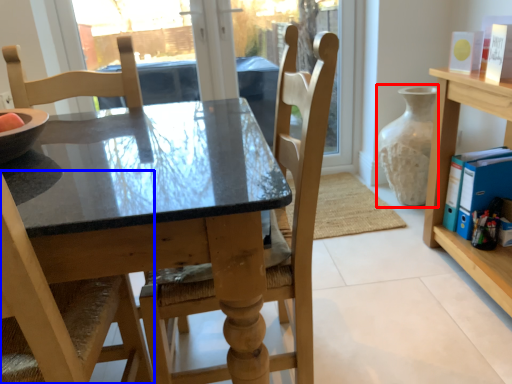
Question: Which object appears farthest to the camera in this image, glass vase (highlighted by a red box) or chair (highlighted by a blue box)?

Choices:
 (A) glass vase
 (B) chair

Answer: (A)